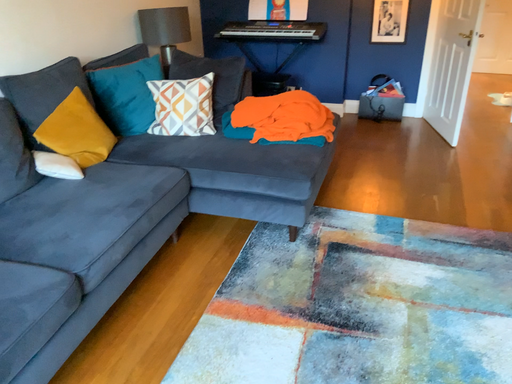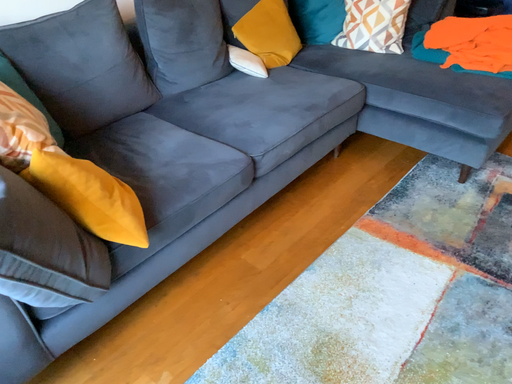
Question: How did the camera likely rotate when shooting the video?

Choices:
 (A) rotated upward
 (B) rotated downward

Answer: (B)